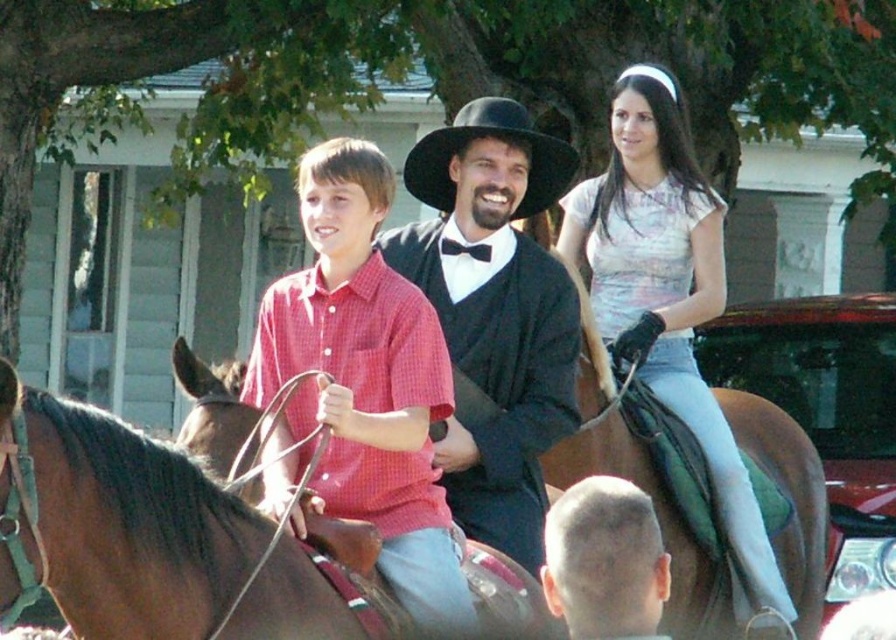
Find the location of a particular element. Image resolution: width=896 pixels, height=640 pixels. brown leather saddle at center is located at coordinates (127, 524).

Locate an element on the screen. The image size is (896, 640). brown leather saddle at center is located at coordinates (127, 524).

I want to click on brown leather saddle at center, so click(x=127, y=524).

Does brown leather saddle at center have a greater height compared to matte black hat at center?

In fact, brown leather saddle at center may be shorter than matte black hat at center.

Looking at this image, is brown leather saddle at center wider than matte black hat at center?

Yes, brown leather saddle at center is wider than matte black hat at center.

Who is more forward, (161,560) or (521,259)?

Point (161,560) is more forward.

The width and height of the screenshot is (896, 640). Identify the location of brown leather saddle at center. (127, 524).

Is red checkered shirt at center to the left of shaved head at center from the viewer's perspective?

Indeed, red checkered shirt at center is positioned on the left side of shaved head at center.

Is point (385, 572) positioned before point (660, 538)?

No, it is behind (660, 538).

Identify the location of red checkered shirt at center. (360, 384).

The image size is (896, 640). Find the location of `red checkered shirt at center`. red checkered shirt at center is located at coordinates (360, 384).